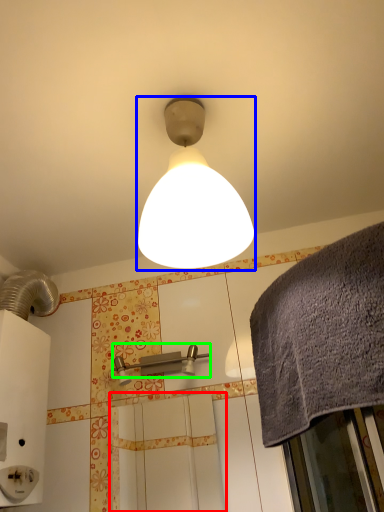
Question: Which object is positioned closest to screen door (highlighted by a red box)? Select from lamp (highlighted by a blue box) and shower (highlighted by a green box).

Choices:
 (A) lamp
 (B) shower

Answer: (B)